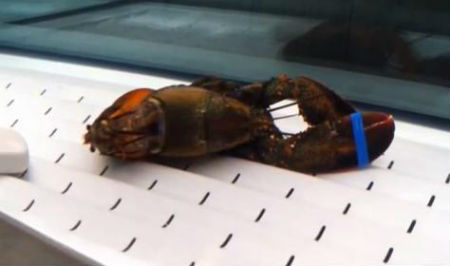
This screenshot has height=266, width=450. Find the location of `surface`. surface is located at coordinates (213, 191).